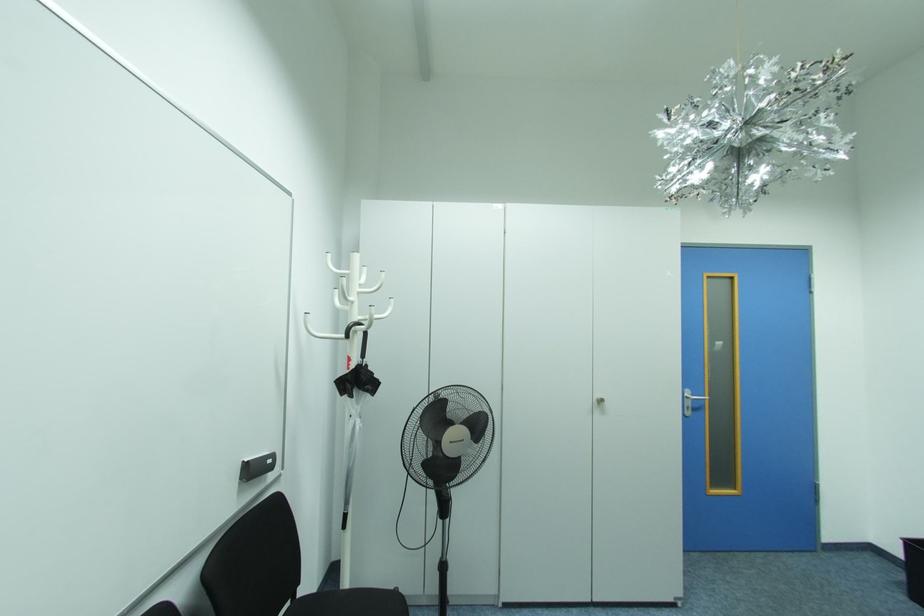
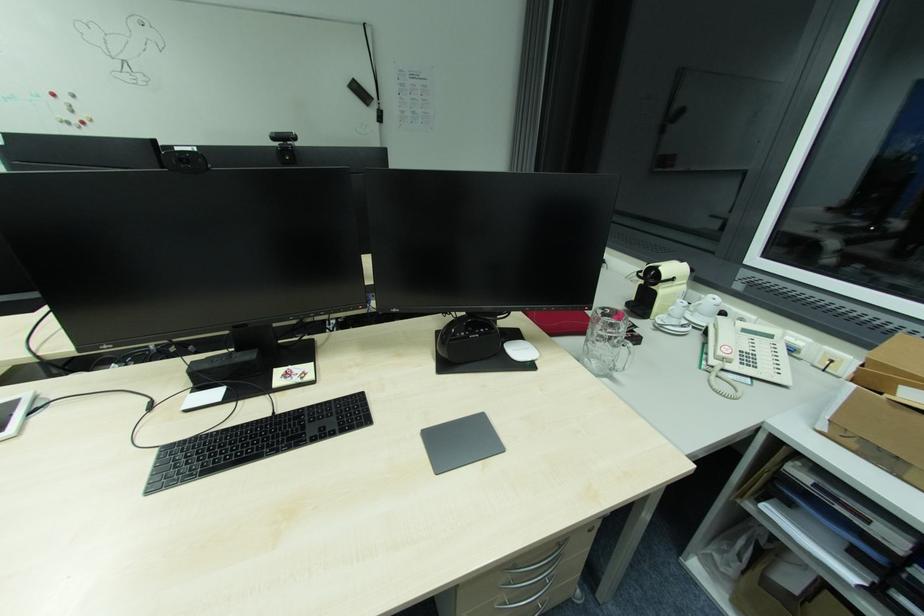
The images are taken continuously from a first-person perspective. In which direction is your viewpoint rotating?

The camera rotated toward right-down.